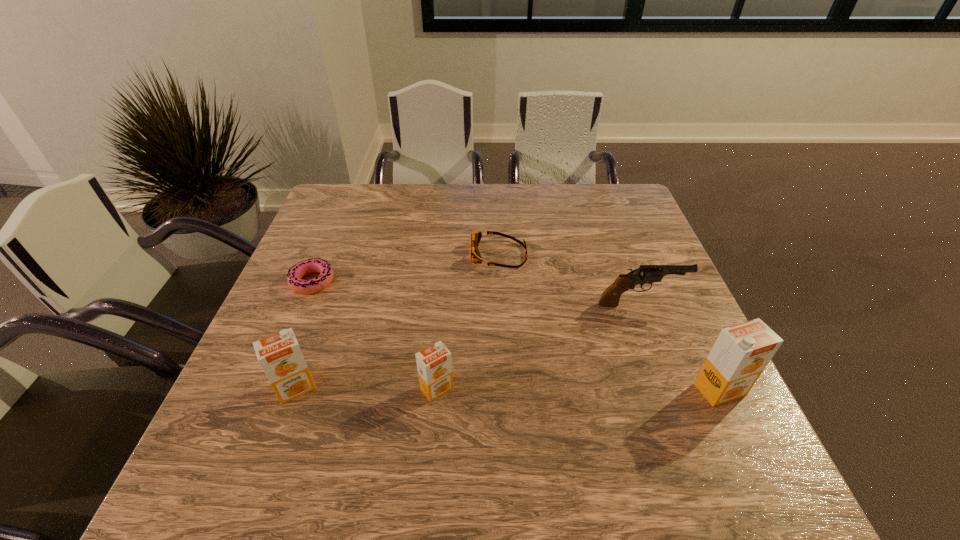
Please mark a free spot for a new orange_juice to balance the arrangement. Please provide its 2D coordinates. Your answer should be formatted as a tuple, i.e. [(x, y)], where the tuple contains the x and y coordinates of a point satisfying the conditions above.

[(578, 389)]